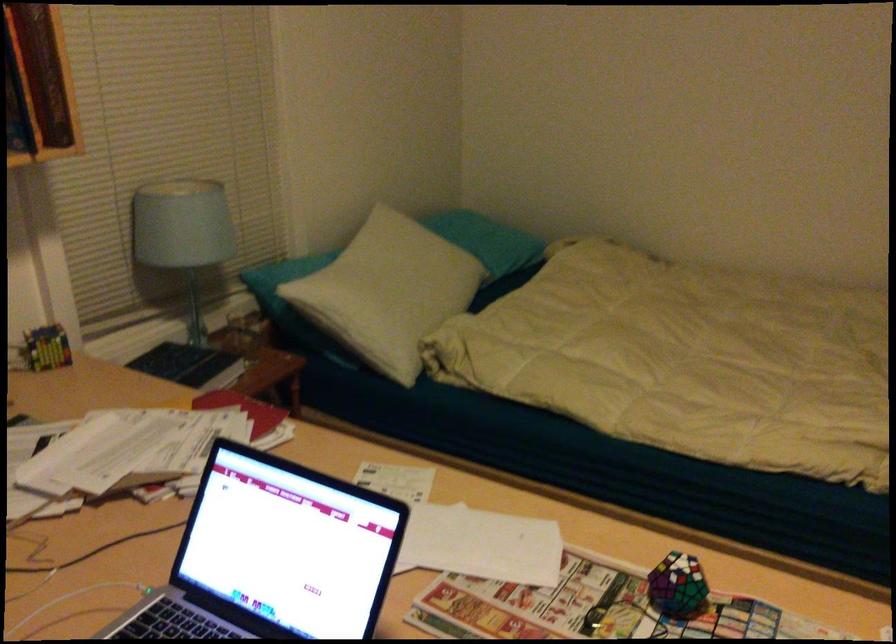
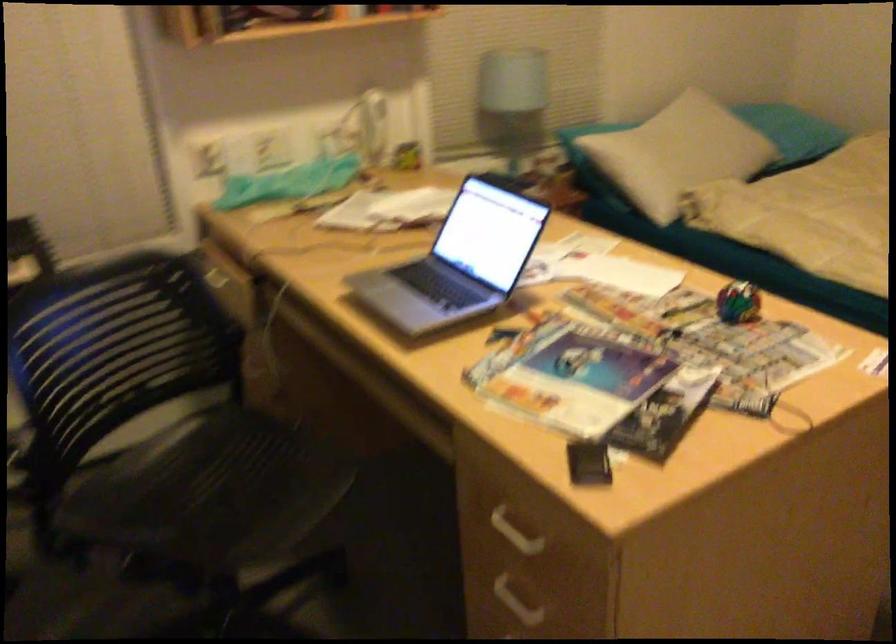
Question: The camera is either moving clockwise (left) or counter-clockwise (right) around the object. The first image is from the beginning of the video and the second image is from the end. Is the camera moving left or right when shooting the video?

Choices:
 (A) Left
 (B) Right

Answer: (B)